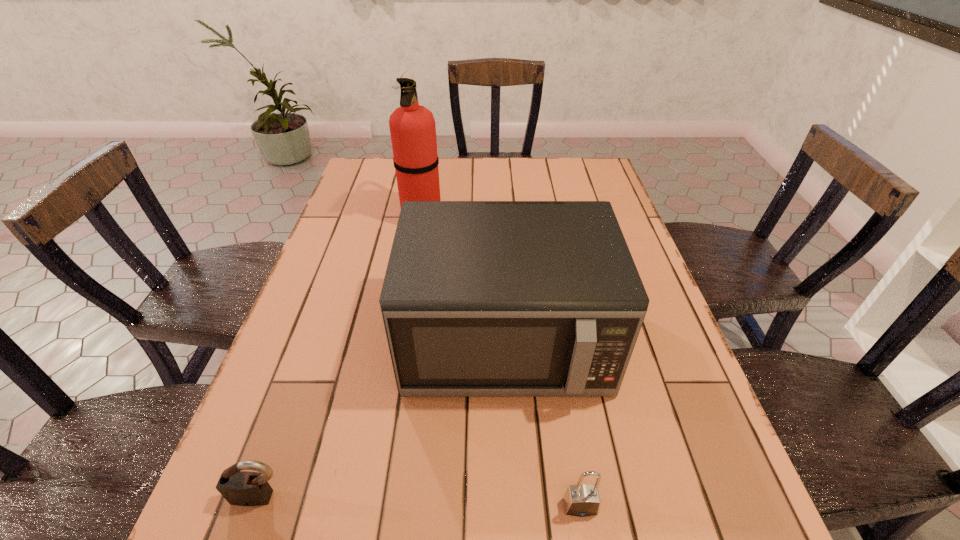
Locate an element on the screen. This screenshot has width=960, height=540. the second closest padlock to the farthest object is located at coordinates (581, 500).

Find the location of a particular element. padlock that stands as the second closest to the farthest object is located at coordinates (581, 500).

Where is `vacant region that satisfies the following two spatial constraints: 1. at the nozzle of the farthest object; 2. with the keyhole on the front of the left padlock`? vacant region that satisfies the following two spatial constraints: 1. at the nozzle of the farthest object; 2. with the keyhole on the front of the left padlock is located at coordinates (374, 497).

Locate an element on the screen. The height and width of the screenshot is (540, 960). vacant space that satisfies the following two spatial constraints: 1. at the nozzle of the tallest object; 2. with the keyhole on the front of the leftmost object is located at coordinates (374, 497).